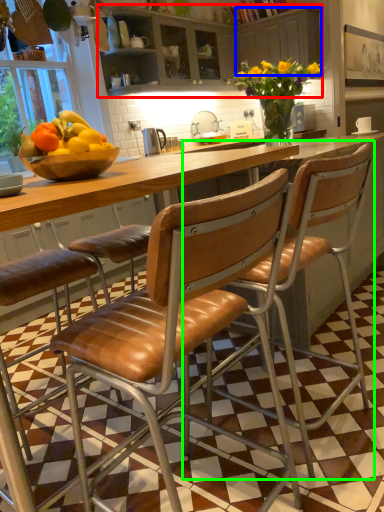
Question: Considering the real-world distances, which object is farthest from cabinetry (highlighted by a red box)? cabinetry (highlighted by a blue box) or chair (highlighted by a green box)?

Choices:
 (A) cabinetry
 (B) chair

Answer: (B)